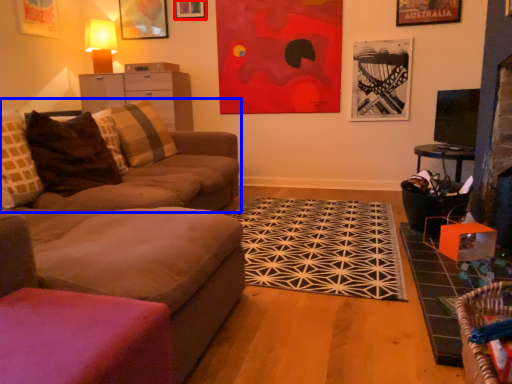
Question: Which of the following is the closest to the observer, picture frame (highlighted by a red box) or studio couch (highlighted by a blue box)?

Choices:
 (A) picture frame
 (B) studio couch

Answer: (B)